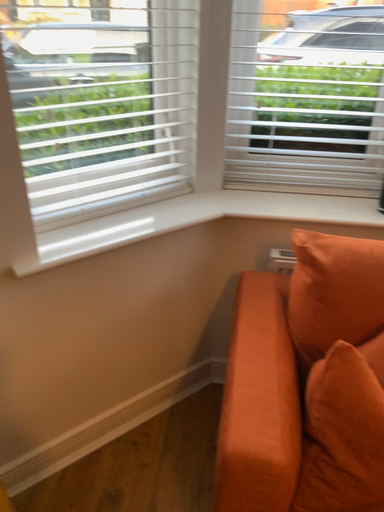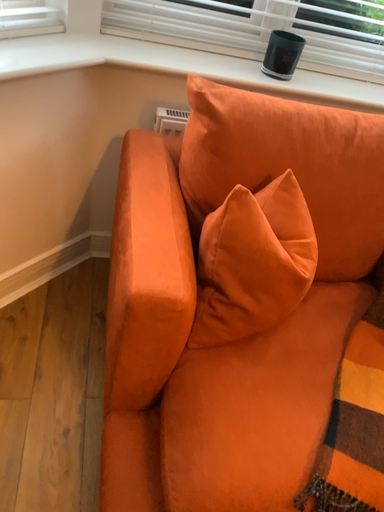
Question: How did the camera likely rotate when shooting the video?

Choices:
 (A) rotated upward
 (B) rotated downward

Answer: (B)